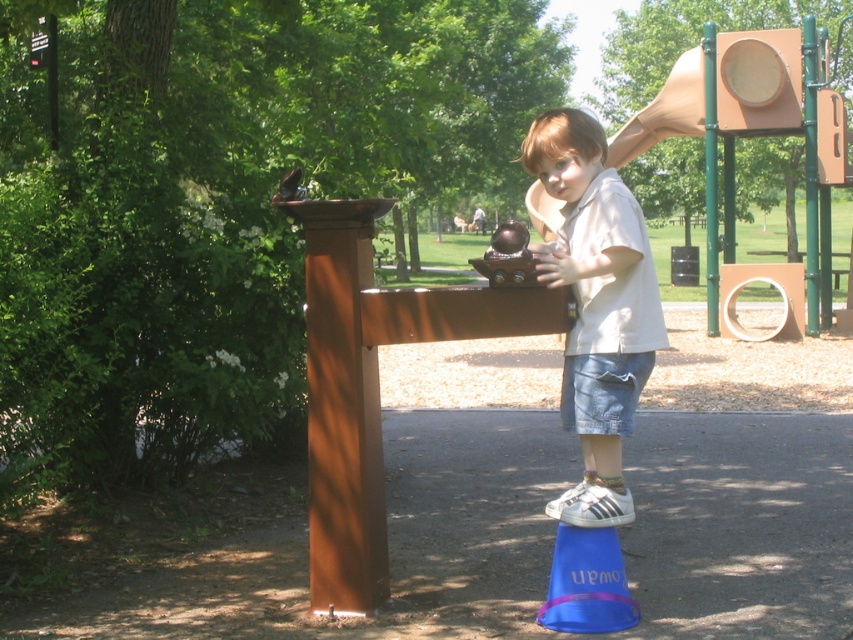
Is blue plastic cone at lower center above metallic brown toy at center?

Incorrect, blue plastic cone at lower center is not positioned above metallic brown toy at center.

Is blue plastic cone at lower center positioned at the back of metallic brown toy at center?

That is True.

Does point (572, 582) lie in front of point (512, 275)?

No, it is behind (512, 275).

This screenshot has height=640, width=853. In order to click on blue plastic cone at lower center in this screenshot , I will do `click(587, 582)`.

Is point (547, 140) positioned behind point (608, 570)?

No.

This screenshot has width=853, height=640. Describe the element at coordinates (596, 307) in the screenshot. I see `light beige cotton shirt at center` at that location.

Measure the distance between point (618, 269) and camera.

Point (618, 269) and camera are 4.67 meters apart from each other.

Image resolution: width=853 pixels, height=640 pixels. What are the coordinates of `light beige cotton shirt at center` in the screenshot? It's located at (596, 307).

Is light beige cotton shirt at center below metallic brown toy at center?

Yes.

How far apart are light beige cotton shirt at center and metallic brown toy at center?

They are 19.18 inches apart.

Who is more forward, (x=599, y=381) or (x=479, y=259)?

Point (x=599, y=381)

Where is `light beige cotton shirt at center`? light beige cotton shirt at center is located at coordinates (596, 307).